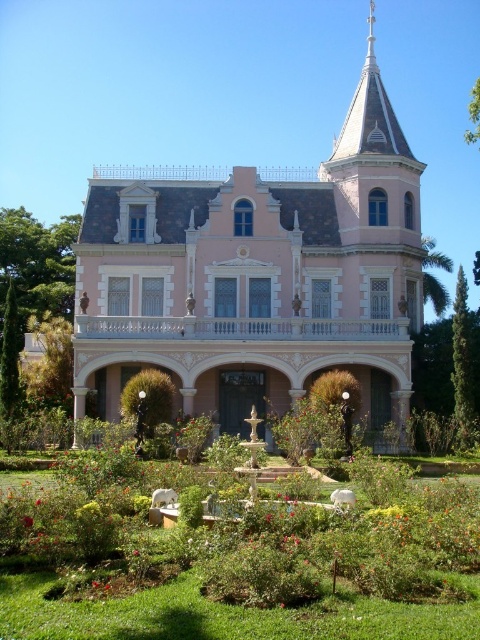
Question: Which object is farther from the camera taking this photo?

Choices:
 (A) green leafy bushes at center
 (B) pink wood mansion at center
 (C) smooth red rose at center

Answer: (B)

Question: Which object is closer to the camera taking this photo?

Choices:
 (A) green leafy bushes at center
 (B) smooth red rose at center
 (C) pink wood mansion at center

Answer: (A)

Question: Can you confirm if pink wood mansion at center is positioned to the right of smooth red rose at center?

Choices:
 (A) yes
 (B) no

Answer: (A)

Question: Can you confirm if green leafy bushes at center is positioned to the left of smooth red rose at center?

Choices:
 (A) no
 (B) yes

Answer: (A)

Question: Is pink wood mansion at center to the left of green leafy bushes at center from the viewer's perspective?

Choices:
 (A) yes
 (B) no

Answer: (B)

Question: Which point is closer to the camera?

Choices:
 (A) (95, 531)
 (B) (168, 189)
 (C) (32, 518)

Answer: (A)